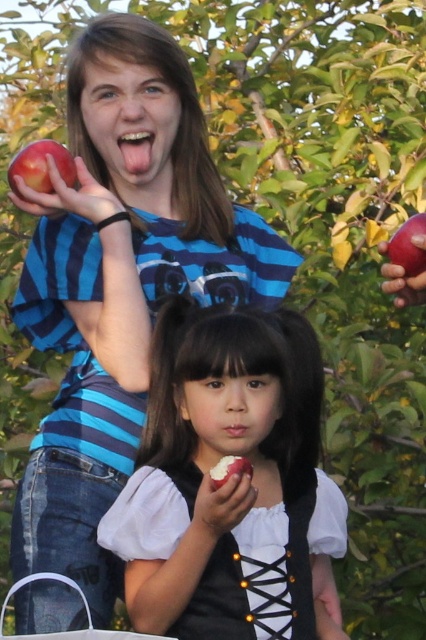
You are a photographer trying to capture a closeup of the red matte apple at lower center and the pink matte lips at center. Which object should you zoom in on to ensure both are in frame without moving the camera?

The red matte apple at lower center is wider than the pink matte lips at center, so you should zoom in on the red matte apple at lower center to ensure both are in frame without moving the camera.

You are trying to decide whether to place the white paper bag at lower left and the red matte apple at lower center into a box that can only hold items narrower than the apple. Can both fit?

The white paper bag at lower left might be wider than the red matte apple at lower center, so it might not fit into the box. The red matte apple at lower center can fit since its width is within the limit.

You are a nutritionist analyzing the image. The smooth white apple at center and the pink matte lips at center are both visible. Which object is bigger in size?

The smooth white apple at center is larger in size compared to the pink matte lips at center.